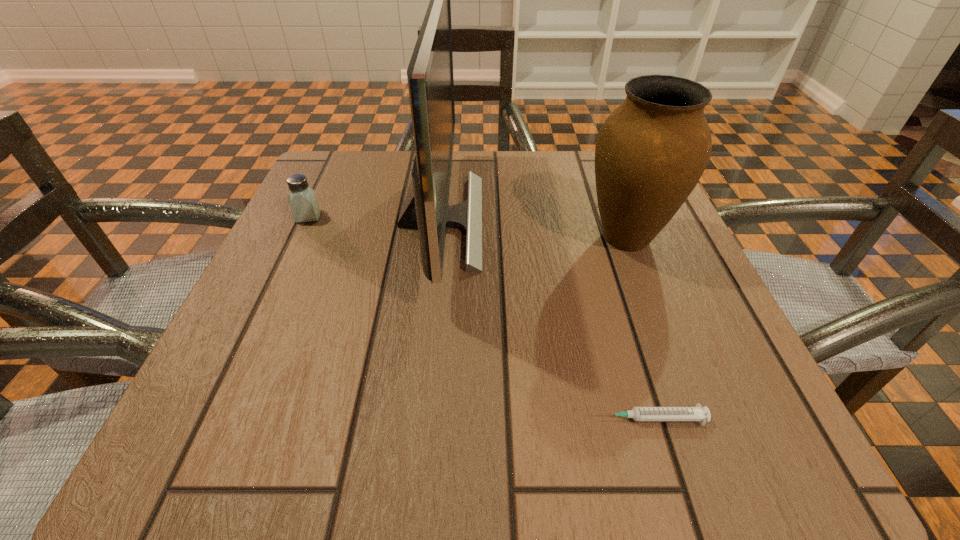
Locate an element on the screen. the second object from left to right is located at coordinates (430, 75).

Identify the location of the tallest object. (430, 75).

In order to click on the second tallest object in this screenshot , I will do `click(650, 153)`.

You are a GUI agent. You are given a task and a screenshot of the screen. Output one action in this format:
    pyautogui.click(x=<x>, y=<y>)
    Task: Click on the saltshaker
    The width and height of the screenshot is (960, 540).
    Given the screenshot: What is the action you would take?
    [x=303, y=202]

You are a GUI agent. You are given a task and a screenshot of the screen. Output one action in this format:
    pyautogui.click(x=<x>, y=<y>)
    Task: Click on the second shortest object
    
    Given the screenshot: What is the action you would take?
    pyautogui.click(x=303, y=202)

Where is `the nearest object`? the nearest object is located at coordinates (697, 413).

Locate an element on the screen. syringe is located at coordinates (697, 413).

Identify the location of free space located on the screen side of the monitor. (569, 220).

The width and height of the screenshot is (960, 540). I want to click on free space located on the left of the urn, so click(363, 238).

Where is `blank space located 0.300m on the front of the saltshaker`? This screenshot has height=540, width=960. blank space located 0.300m on the front of the saltshaker is located at coordinates (246, 350).